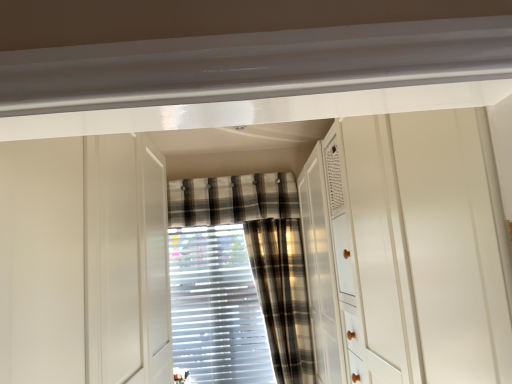
Question: Is plaid fabric curtain at center, the first curtain from the front, positioned beyond the bounds of plaid fabric curtain at center, which ranks as the second curtain in back-to-front order?

Choices:
 (A) yes
 (B) no

Answer: (A)

Question: Does plaid fabric curtain at center, the first curtain from the front, have a greater height compared to plaid fabric curtain at center, acting as the 2th curtain starting from the front?

Choices:
 (A) yes
 (B) no

Answer: (A)

Question: Can you confirm if plaid fabric curtain at center, the first curtain from the front, is positioned to the right of plaid fabric curtain at center, which ranks as the second curtain in back-to-front order?

Choices:
 (A) no
 (B) yes

Answer: (B)

Question: Is plaid fabric curtain at center, the first curtain from the front, looking in the opposite direction of plaid fabric curtain at center, which ranks as the second curtain in back-to-front order?

Choices:
 (A) no
 (B) yes

Answer: (A)

Question: Is plaid fabric curtain at center, the third curtain from the back, directly adjacent to plaid fabric curtain at center, which ranks as the second curtain in back-to-front order?

Choices:
 (A) no
 (B) yes

Answer: (A)

Question: Is plaid fabric curtain at center, acting as the 2th curtain starting from the front, situated inside plaid fabric curtain at center, the first curtain from the front, or outside?

Choices:
 (A) inside
 (B) outside

Answer: (B)

Question: In the image, is plaid fabric curtain at center, which ranks as the second curtain in back-to-front order, positioned in front of or behind plaid fabric curtain at center, the third curtain from the back?

Choices:
 (A) behind
 (B) front

Answer: (A)

Question: Would you say plaid fabric curtain at center, which ranks as the second curtain in back-to-front order, is to the left or to the right of plaid fabric curtain at center, the third curtain from the back, in the picture?

Choices:
 (A) left
 (B) right

Answer: (A)

Question: From the image's perspective, relative to plaid fabric curtain at center, the third curtain from the back, is plaid fabric curtain at center, acting as the 2th curtain starting from the front, above or below?

Choices:
 (A) above
 (B) below

Answer: (A)

Question: Considering their positions, is plaid fabric curtain at center, the 3th curtain positioned from the front, located in front of or behind plaid fabric curtain at center, acting as the 2th curtain starting from the front?

Choices:
 (A) behind
 (B) front

Answer: (A)

Question: Considering the positions of plaid fabric curtain at center, the first curtain viewed from the back, and plaid fabric curtain at center, acting as the 2th curtain starting from the front, in the image, is plaid fabric curtain at center, the first curtain viewed from the back, taller or shorter than plaid fabric curtain at center, acting as the 2th curtain starting from the front,?

Choices:
 (A) short
 (B) tall

Answer: (B)

Question: From a real-world perspective, is plaid fabric curtain at center, the 3th curtain positioned from the front, positioned above or below plaid fabric curtain at center, which ranks as the second curtain in back-to-front order?

Choices:
 (A) below
 (B) above

Answer: (A)

Question: Does point (229, 218) appear closer or farther from the camera than point (250, 188)?

Choices:
 (A) farther
 (B) closer

Answer: (B)

Question: Is point (117, 157) closer or farther from the camera than point (283, 362)?

Choices:
 (A) closer
 (B) farther

Answer: (A)

Question: Based on their positions, is white glossy cabinet at center located to the left or right of plaid fabric curtain at center, the first curtain from the front?

Choices:
 (A) left
 (B) right

Answer: (A)